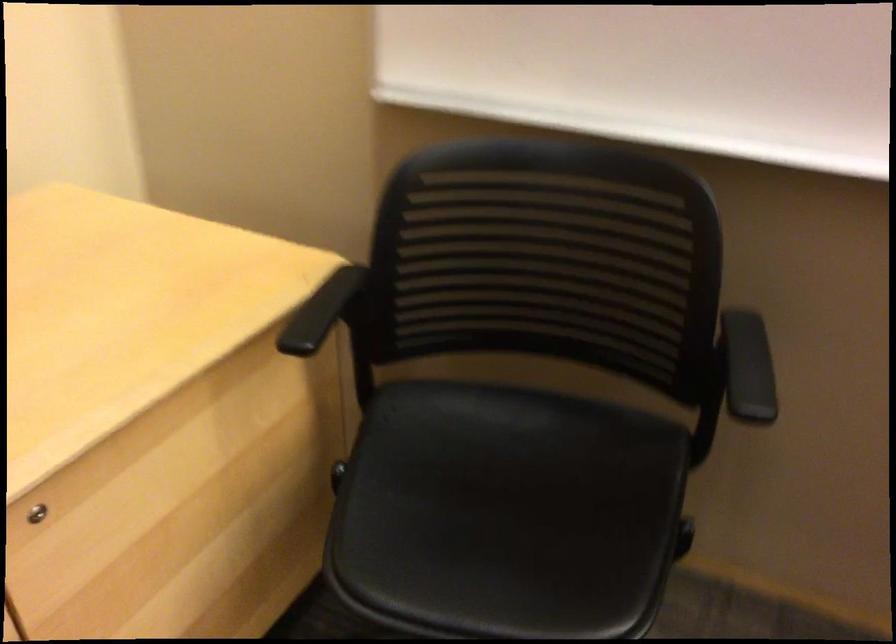
Where would you turn the silver cabinet lock? Please return your answer as a coordinate pair (x, y).

(37, 514)